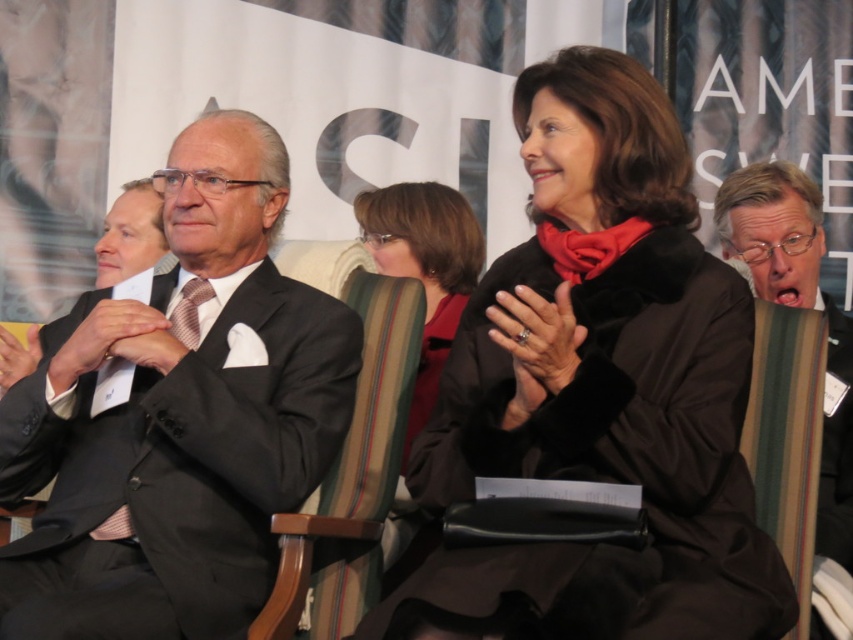
You are standing in the center of the room and want to move towards the velvet black coat at center. Which direction should you move in order to reach it?

The velvet black coat at center is located at point 0.609 on the x axis and 0.703 on the y axis. Since you are at the center of the room, you should move towards the northeast direction to reach it.

You are a photographer at the event and need to ensure both the velvet black coat at center and the matte red coat at center are visible in the photo. Given their height difference, where should you position your camera to capture both effectively?

The velvet black coat at center is much taller than the matte red coat at center. To capture both effectively, position the camera at a lower angle to include the full height of the taller velvet black coat while still framing the shorter matte red coat appropriately.